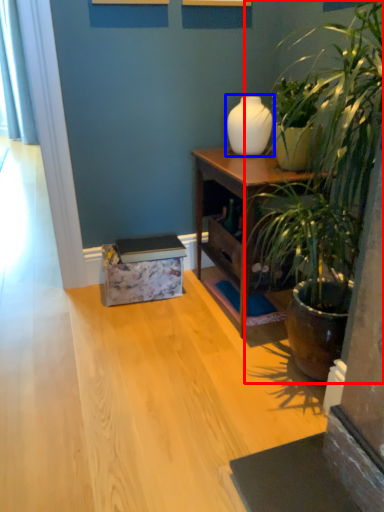
Question: Among these objects, which one is farthest to the camera, houseplant (highlighted by a red box) or vase (highlighted by a blue box)?

Choices:
 (A) houseplant
 (B) vase

Answer: (B)